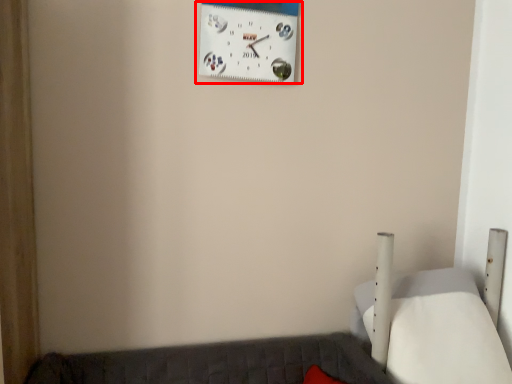
Question: Where is wall clock (annotated by the red box) located in relation to furniture in the image?

Choices:
 (A) right
 (B) left

Answer: (B)